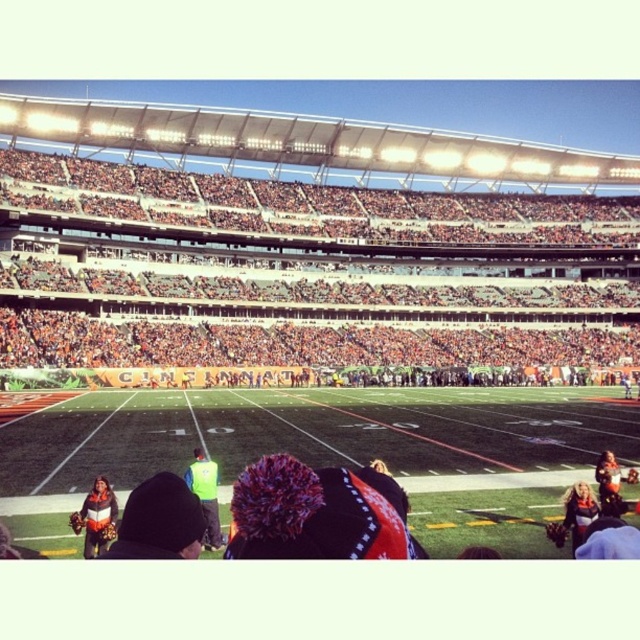
Question: Is neon yellow vest at center positioned at the back of orange jersey at lower right?

Choices:
 (A) no
 (B) yes

Answer: (A)

Question: Which of the following is the closest to the observer?

Choices:
 (A) (209, 545)
 (B) (618, 516)
 (C) (166, 541)

Answer: (C)

Question: Is orange fabric seats at upper center behind orange and white striped jacket at lower left?

Choices:
 (A) no
 (B) yes

Answer: (B)

Question: Can you confirm if orange fabric seats at upper center is positioned to the left of orange jersey at lower right?

Choices:
 (A) yes
 (B) no

Answer: (B)

Question: Which of the following is the farthest from the observer?

Choices:
 (A) orange and white striped jacket at lower left
 (B) neon yellow vest at center
 (C) orange fabric seats at upper center

Answer: (C)

Question: Which point is closer to the camera taking this photo?

Choices:
 (A) (182, 532)
 (B) (195, 458)
 (C) (115, 516)
 (D) (605, 513)

Answer: (A)